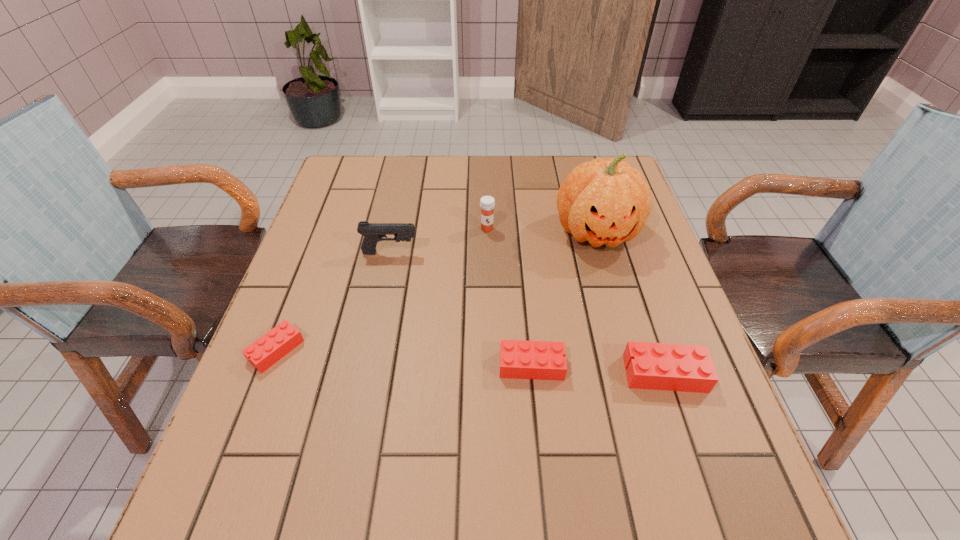
You are a GUI agent. You are given a task and a screenshot of the screen. Output one action in this format:
    pyautogui.click(x=<x>, y=<y>)
    Task: Click on the free spot between the second shortest object and the pistol
    Image resolution: width=960 pixels, height=540 pixels.
    Given the screenshot: What is the action you would take?
    coord(461,309)

The width and height of the screenshot is (960, 540). I want to click on empty space between the rightmost Lego and the shortest object, so click(x=470, y=362).

Identify the location of free area in between the third shortest object and the fourth object from right to left. This screenshot has height=540, width=960. (576, 301).

Locate an element on the screen. vacant space that is in between the pumpkin and the medicine is located at coordinates (541, 230).

Locate which object is the third closest to the fourth object from left to right. Please provide its 2D coordinates. Your answer should be formatted as a tuple, i.e. [(x, y)], where the tuple contains the x and y coordinates of a point satisfying the conditions above.

[(373, 232)]

Point out which object is positioned as the third nearest to the leftmost object. Please provide its 2D coordinates. Your answer should be formatted as a tuple, i.e. [(x, y)], where the tuple contains the x and y coordinates of a point satisfying the conditions above.

[(487, 203)]

Identify which Lego is the second closest to the medicine. Please provide its 2D coordinates. Your answer should be formatted as a tuple, i.e. [(x, y)], where the tuple contains the x and y coordinates of a point satisfying the conditions above.

[(655, 366)]

Find the location of a particular element. The width and height of the screenshot is (960, 540). Lego that is the second closest to the third object from right to left is located at coordinates (263, 353).

Image resolution: width=960 pixels, height=540 pixels. Identify the location of free location that satisfies the following two spatial constraints: 1. at the barrel of the second object from left to right; 2. on the front side of the leftmost Lego. (371, 350).

Locate an element on the screen. The height and width of the screenshot is (540, 960). vacant space that satisfies the following two spatial constraints: 1. on the label side of the second Lego from right to left; 2. on the left side of the fourth object from right to left is located at coordinates [x=490, y=366].